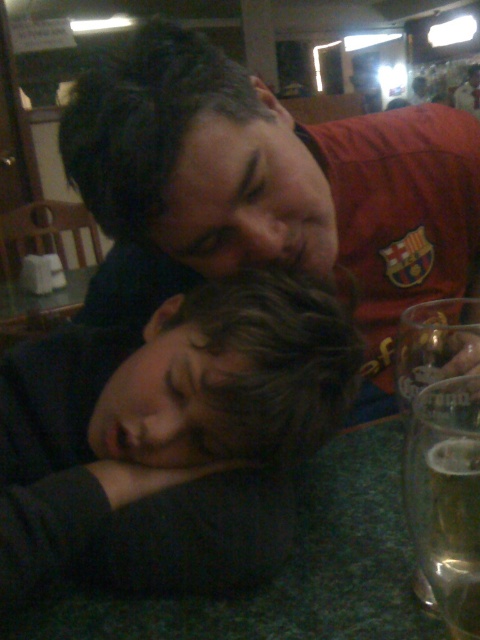
Question: Does matte red shirt at center come behind clear glass beer at lower right?

Choices:
 (A) yes
 (B) no

Answer: (A)

Question: Is matte red shirt at center above clear glass beer at lower right?

Choices:
 (A) no
 (B) yes

Answer: (B)

Question: Which of the following is the closest to the observer?

Choices:
 (A) (282, 144)
 (B) (444, 531)
 (C) (229, 461)

Answer: (B)

Question: Which point is closer to the camera?

Choices:
 (A) (204, 250)
 (B) (444, 480)
 (C) (213, 362)

Answer: (B)

Question: Which of the following is the closest to the observer?

Choices:
 (A) matte red shirt at center
 (B) clear glass beer at lower right

Answer: (B)

Question: Is dark brown hair at lower left wider than matte red shirt at center?

Choices:
 (A) yes
 (B) no

Answer: (B)